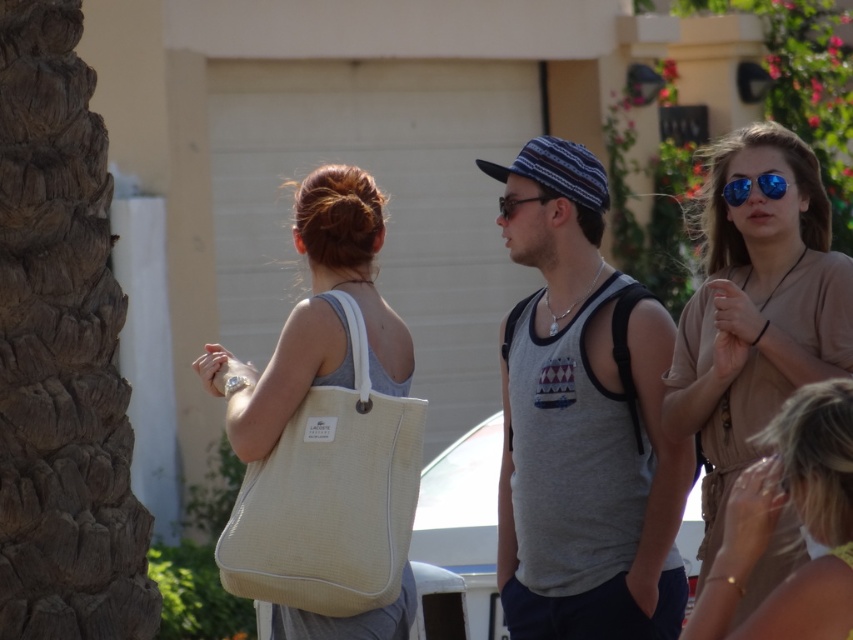
Based on the scene description, where is the matte brown dress at center located in terms of its 2D coordinates?

The matte brown dress at center is located at the 2D coordinates point [755,308].

You are a photographer trying to capture a candid shot of the gray cotton tank top at center and the beige fabric dress at lower right. Which of the two is positioned farther away from the camera?

The beige fabric dress at lower right is behind the gray cotton tank top at center, so it is farther away from the camera.